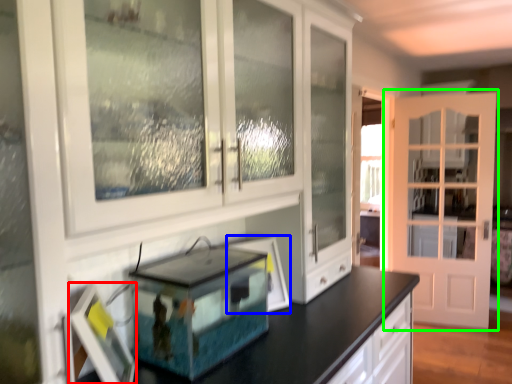
Question: Which object is positioned farthest from picture frame (highlighted by a red box)? Select from picture frame (highlighted by a blue box) and door (highlighted by a green box).

Choices:
 (A) picture frame
 (B) door

Answer: (B)